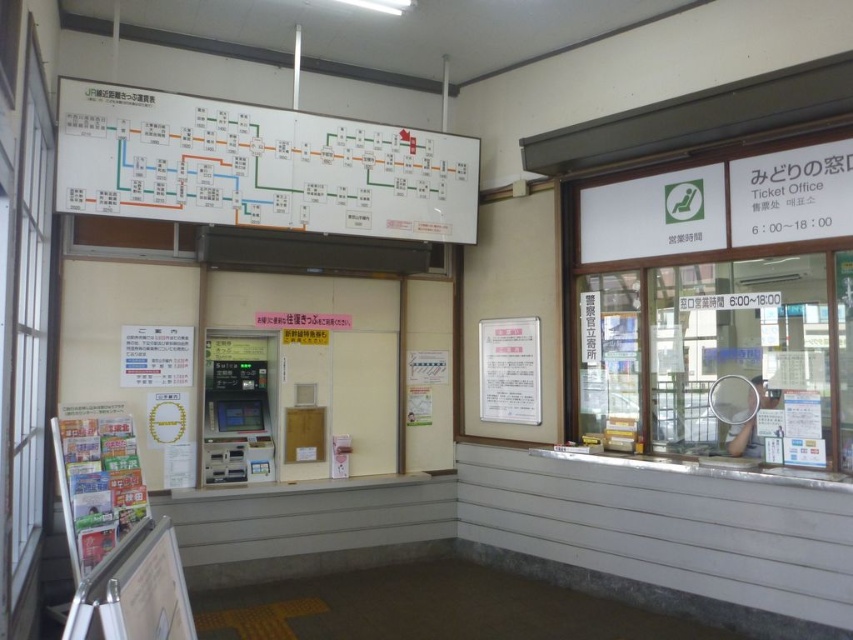
You are a passenger in the train station ticket office. You need to buy a ticket but the ticket counter is closed. You see the white glass window at right and the metallic gray atm at center. Which object is higher up?

The white glass window at right is above the metallic gray atm at center, so the white glass window at right is higher up.

You are a traveler who just entered the train station and need to find the ticket office. You see a white paper map at upper center and a metallic gray atm at center. Which object is located higher up in the scene?

The white paper map at upper center is located higher up than the metallic gray atm at center.

You are a traveler who just entered the train station ticket office. You need to purchase a ticket but see both the white glass window at right and the metallic gray atm at center. Which one should you approach if you want to buy a ticket?

The white glass window at right is much taller as metallic gray atm at center. So you should approach the white glass window at right to buy a ticket because it is likely the ticket counter staffed by an agent, while the metallic gray atm at center is an automated machine possibly for cash withdrawals or other services.